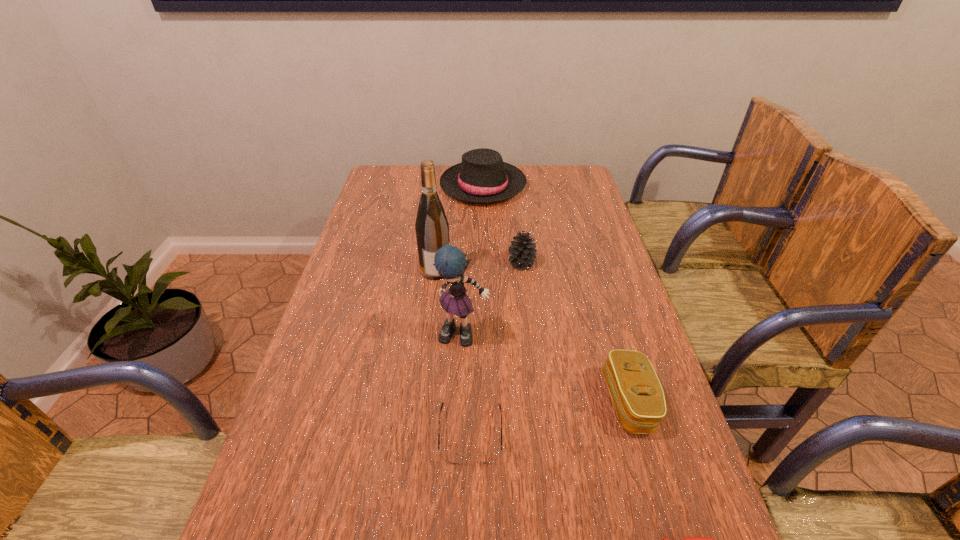
Find the location of a particular element. This screenshot has height=540, width=960. free space located 0.070m on the back of the pinecone is located at coordinates (519, 241).

I want to click on vacant region located on the zipper side of the clutch bag, so click(435, 402).

This screenshot has width=960, height=540. What are the coordinates of `free space located on the zipper side of the clutch bag` in the screenshot? It's located at (547, 402).

At what (x,y) coordinates should I click in order to perform the action: click on free space located on the zipper side of the clutch bag. Please return your answer as a coordinate pair (x, y). Looking at the image, I should click on (579, 402).

Image resolution: width=960 pixels, height=540 pixels. Identify the location of free spot located on the front-facing side of the sixth tallest object. (469, 538).

The image size is (960, 540). Identify the location of object that is at the far edge. (482, 177).

This screenshot has width=960, height=540. I want to click on object located in the right edge section of the desktop, so click(x=637, y=394).

What are the coordinates of `free space at the left edge of the desktop` in the screenshot? It's located at (378, 239).

Where is `vacant space at the right edge of the desktop`? The height and width of the screenshot is (540, 960). vacant space at the right edge of the desktop is located at coordinates (593, 254).

Identify the location of vacant area at the far right corner. (558, 190).